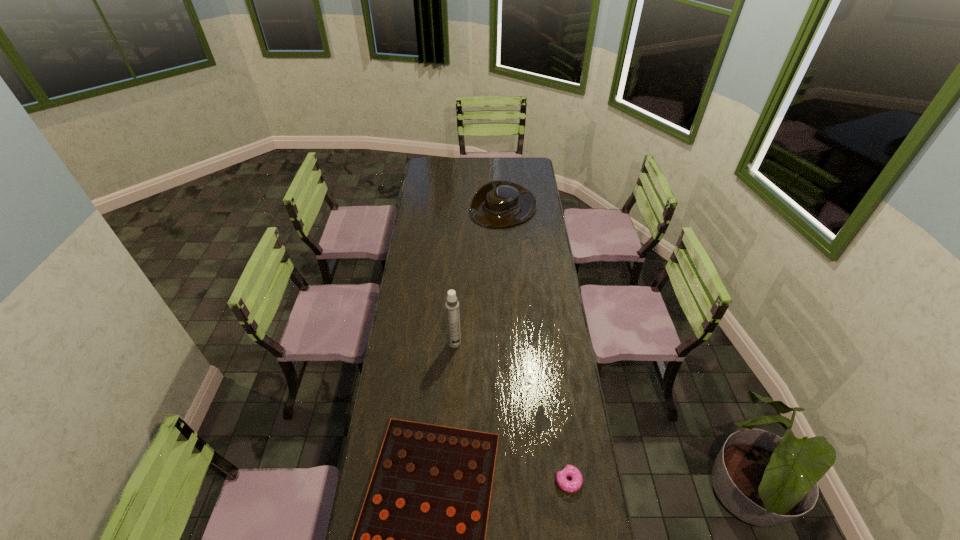
Image resolution: width=960 pixels, height=540 pixels. What are the coordinates of `the third closest object to the second farthest object` in the screenshot? It's located at (497, 204).

Identify the location of object that ranks as the third closest to the third shortest object. (575, 484).